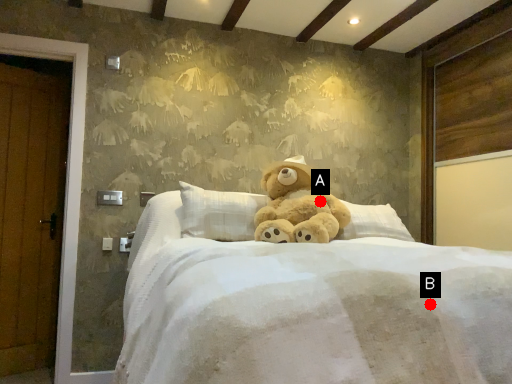
Question: Two points are circled on the image, labeled by A and B beside each circle. Which point is farther to the camera?

Choices:
 (A) A is further
 (B) B is further

Answer: (A)